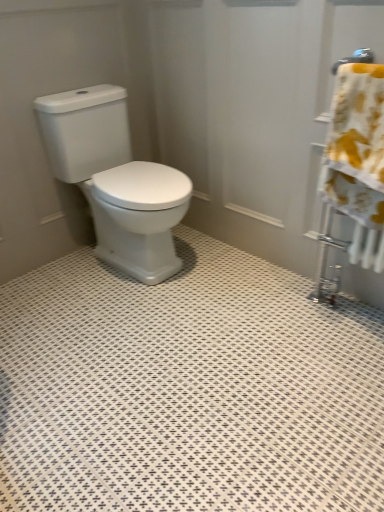
Find the location of a particular element. The image size is (384, 512). unoccupied area in front of white glossy toilet at center is located at coordinates (130, 325).